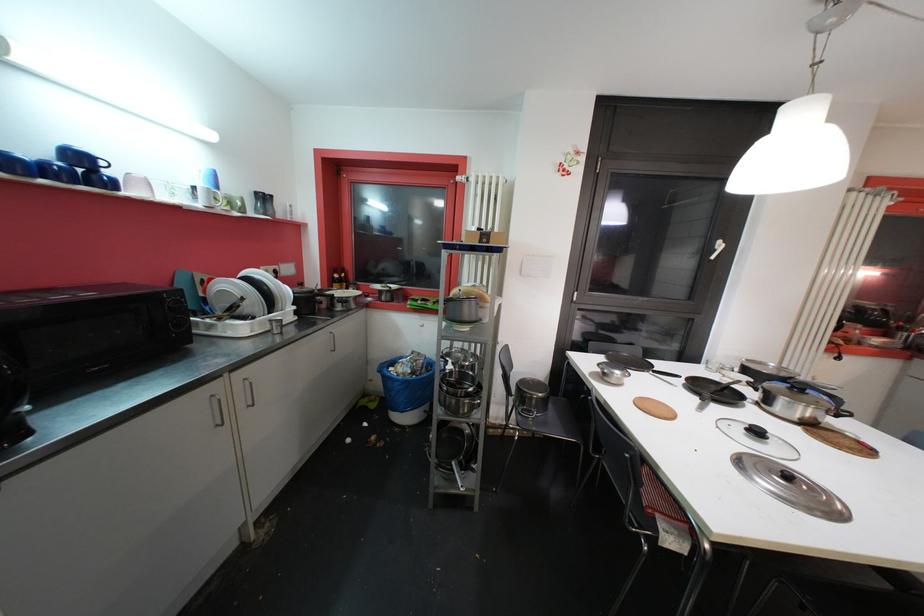
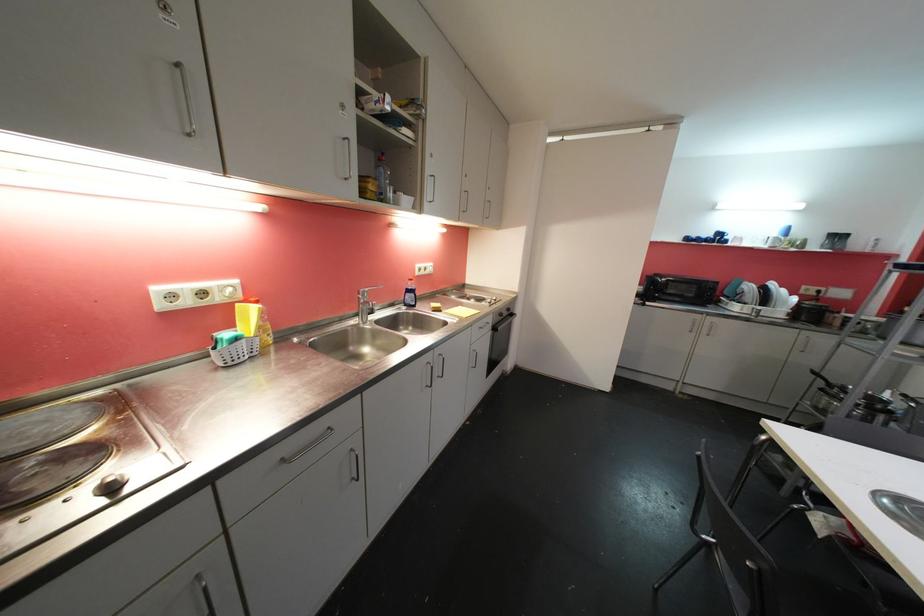
The point at (207, 184) is marked in the first image. Where is the corresponding point in the second image?

(781, 236)